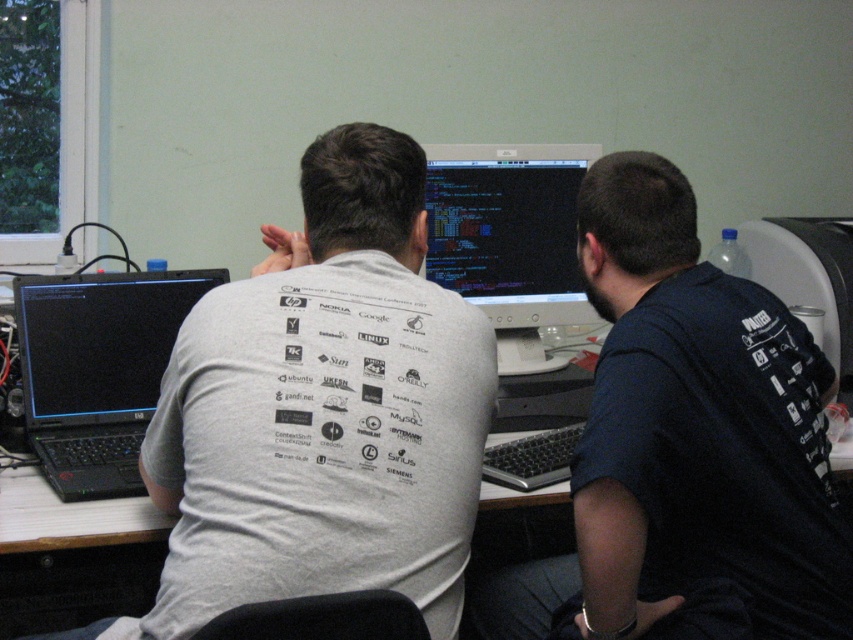
Does black matte laptop at left have a lesser height compared to matte black monitor at center?

Yes, black matte laptop at left is shorter than matte black monitor at center.

Between black matte laptop at left and matte black monitor at center, which one has more height?

With more height is matte black monitor at center.

The image size is (853, 640). Describe the element at coordinates (97, 369) in the screenshot. I see `black matte laptop at left` at that location.

The width and height of the screenshot is (853, 640). Find the location of `black matte laptop at left`. black matte laptop at left is located at coordinates (97, 369).

Is dark blue t-shirt at center wider than black matte laptop at left?

Yes, dark blue t-shirt at center is wider than black matte laptop at left.

Does dark blue t-shirt at center have a lesser width compared to black matte laptop at left?

In fact, dark blue t-shirt at center might be wider than black matte laptop at left.

What do you see at coordinates (686, 442) in the screenshot? I see `dark blue t-shirt at center` at bounding box center [686, 442].

Locate an element on the screen. The height and width of the screenshot is (640, 853). dark blue t-shirt at center is located at coordinates (686, 442).

Does dark blue t-shirt at center have a lesser height compared to matte black monitor at center?

Incorrect, dark blue t-shirt at center's height does not fall short of matte black monitor at center's.

Between dark blue t-shirt at center and matte black monitor at center, which one is positioned higher?

Positioned higher is matte black monitor at center.

Describe the element at coordinates (686, 442) in the screenshot. I see `dark blue t-shirt at center` at that location.

Where is `dark blue t-shirt at center`? dark blue t-shirt at center is located at coordinates (686, 442).